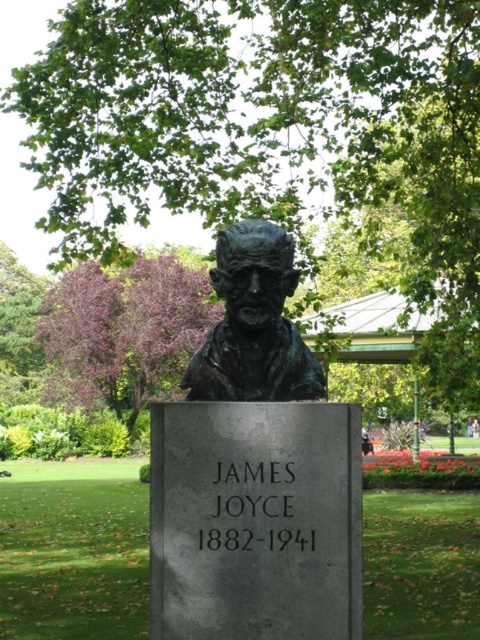
You are standing in front of the bronze bust of James Joyce mounted on a rectangular stone pedestal. You notice a purple leafy tree in the background. Can you tell me the exact coordinates of the purple leafy tree at upper left?

The purple leafy tree at upper left is located at coordinates point (x=123, y=332).

You are standing in a park and see the bronze bust at center and the green leafy tree at upper center. Which object is closer to you?

The green leafy tree at upper center is closer to you because it is described as being further to the viewer than the bronze bust at center.

What is the spatial relationship between the green leafy tree at upper center and the purple leafy tree at upper left in the park scene?

The green leafy tree at upper center is positioned on the right side of the purple leafy tree at upper left.